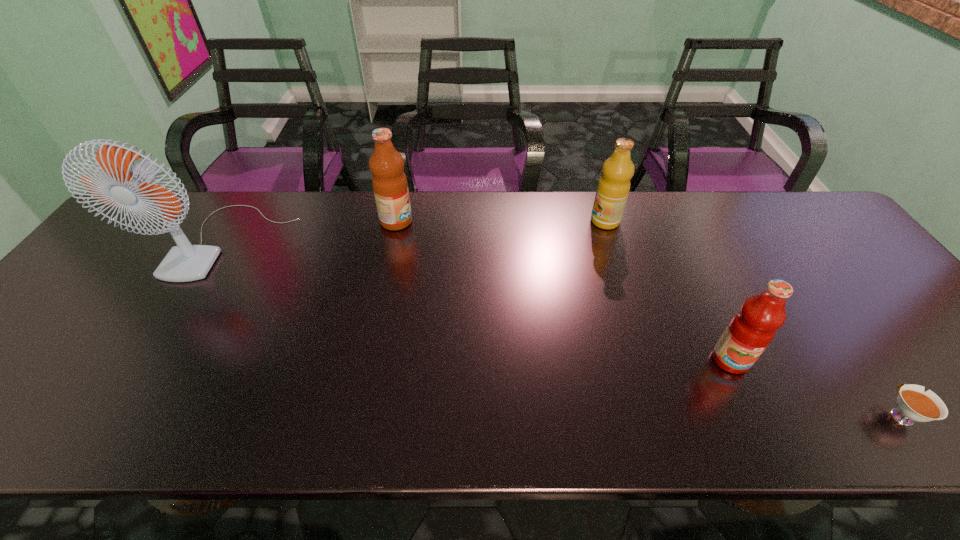
The height and width of the screenshot is (540, 960). What are the coordinates of `vacant area situated on the front label of the third object from right to left` in the screenshot? It's located at (508, 221).

Where is `vacant space situated on the front label of the third object from right to left`? The width and height of the screenshot is (960, 540). vacant space situated on the front label of the third object from right to left is located at coordinates (564, 221).

At what (x,y) coordinates should I click in order to perform the action: click on vacant space situated 0.170m on the front label of the third object from right to left. Please return your answer as a coordinate pair (x, y). The image size is (960, 540). Looking at the image, I should click on (534, 221).

Find the location of `blank space located 0.340m on the side of the nearest object with the handle`. blank space located 0.340m on the side of the nearest object with the handle is located at coordinates (804, 279).

The image size is (960, 540). Find the location of `free space located 0.320m on the side of the nearest object with the handle`. free space located 0.320m on the side of the nearest object with the handle is located at coordinates (808, 285).

Locate an element on the screen. This screenshot has height=540, width=960. blank space located 0.110m on the side of the nearest object with the handle is located at coordinates (855, 352).

The image size is (960, 540). I want to click on fan that is at the far edge, so click(185, 262).

This screenshot has height=540, width=960. I want to click on object that is at the near edge, so click(x=914, y=404).

Identify the location of object present at the left edge. This screenshot has height=540, width=960. (185, 262).

The height and width of the screenshot is (540, 960). What are the coordinates of `object at the right edge` in the screenshot? It's located at (914, 404).